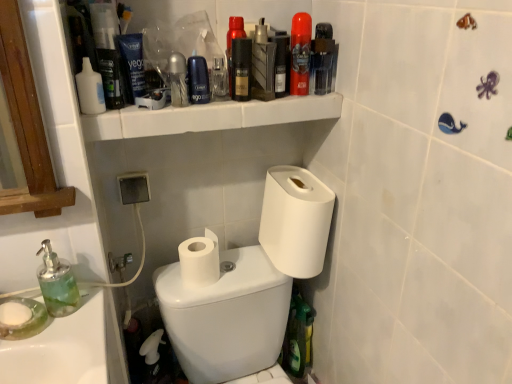
What do you see at coordinates (241, 69) in the screenshot?
I see `matte black bottle at center, acting as the fifth mouthwash starting from the left` at bounding box center [241, 69].

Measure the distance between point (x=215, y=245) and camera.

Point (x=215, y=245) is 1.09 meters away from camera.

The image size is (512, 384). Find the location of `shiny black bottle at upper center, placed as the 4th mouthwash when sorted from left to right`. shiny black bottle at upper center, placed as the 4th mouthwash when sorted from left to right is located at coordinates (232, 44).

Is transparent plastic mouthwash at upper right, the 9th mouthwash when ordered from left to right, turned away from green glass soap dispenser at lower left?

No, transparent plastic mouthwash at upper right, the 9th mouthwash when ordered from left to right, is not facing the opposite direction of green glass soap dispenser at lower left.

Visually, is transparent plastic mouthwash at upper right, the 9th mouthwash when ordered from left to right, positioned to the left or to the right of green glass soap dispenser at lower left?

In the image, transparent plastic mouthwash at upper right, the 9th mouthwash when ordered from left to right, appears on the right side of green glass soap dispenser at lower left.

From a real-world perspective, does transparent plastic mouthwash at upper right, the 9th mouthwash when ordered from left to right, sit lower than green glass soap dispenser at lower left?

No, from a real-world perspective, transparent plastic mouthwash at upper right, the 9th mouthwash when ordered from left to right, is not beneath green glass soap dispenser at lower left.

Which of these two, transparent plastic mouthwash at upper right, the 9th mouthwash when ordered from left to right, or green glass soap dispenser at lower left, is bigger?

Bigger between the two is green glass soap dispenser at lower left.

Considering the positions of objects transparent plastic mouthwash at upper right, positioned as the 1th mouthwash in right-to-left order, and white plastic bidet at lower right in the image provided, who is more to the left, transparent plastic mouthwash at upper right, positioned as the 1th mouthwash in right-to-left order, or white plastic bidet at lower right?

white plastic bidet at lower right is more to the left.

Considering the relative sizes of transparent plastic mouthwash at upper right, the 9th mouthwash when ordered from left to right, and white plastic bidet at lower right in the image provided, is transparent plastic mouthwash at upper right, the 9th mouthwash when ordered from left to right, shorter than white plastic bidet at lower right?

Yes.

Which of these two, transparent plastic mouthwash at upper right, positioned as the 1th mouthwash in right-to-left order, or white plastic bidet at lower right, is wider?

white plastic bidet at lower right is wider.

Considering the points (327, 91) and (183, 325), which point is in front, point (327, 91) or point (183, 325)?

The point (327, 91) is more forward.

The height and width of the screenshot is (384, 512). I want to click on the 2nd toilet paper directly beneath the blue matte tube at upper center, the second mouthwash in the left-to-right sequence (from a real-world perspective), so click(x=199, y=260).

Is blue matte tube at upper center, which is the 8th mouthwash in right-to-left order, oriented towards white matte toilet paper at center, placed as the second toilet paper when sorted from right to left?

No, blue matte tube at upper center, which is the 8th mouthwash in right-to-left order, is not facing towards white matte toilet paper at center, placed as the second toilet paper when sorted from right to left.

Based on the photo, are blue matte tube at upper center, which is the 8th mouthwash in right-to-left order, and white matte toilet paper at center, placed as the second toilet paper when sorted from right to left, located far from each other?

No, blue matte tube at upper center, which is the 8th mouthwash in right-to-left order, is not far from white matte toilet paper at center, placed as the second toilet paper when sorted from right to left.

Between blue matte tube at upper center, the second mouthwash in the left-to-right sequence, and white matte toilet paper at center, placed as the second toilet paper when sorted from right to left, which one has less height?

Standing shorter between the two is white matte toilet paper at center, placed as the second toilet paper when sorted from right to left.

Is matte blue shaving cream canister at upper center closer to camera compared to white plastic bidet at lower right?

That is False.

Is matte blue shaving cream canister at upper center surrounding white plastic bidet at lower right?

No, white plastic bidet at lower right is not surrounded by matte blue shaving cream canister at upper center.

Is point (201, 63) behind point (177, 324)?

No.

From the picture: Based on their positions, is matte blue shaving cream canister at upper center located to the left or right of white plastic bidet at lower right?

matte blue shaving cream canister at upper center is to the left of white plastic bidet at lower right.

Considering the sizes of green glass soap dispenser at lower left and metallic silver mouthwash at upper center, which appears as the third mouthwash when viewed from the left, in the image, is green glass soap dispenser at lower left wider or thinner than metallic silver mouthwash at upper center, which appears as the third mouthwash when viewed from the left,?

Considering their sizes, green glass soap dispenser at lower left looks broader than metallic silver mouthwash at upper center, which appears as the third mouthwash when viewed from the left.

Would you say green glass soap dispenser at lower left is inside or outside metallic silver mouthwash at upper center, the 7th mouthwash viewed from the right?

green glass soap dispenser at lower left is not enclosed by metallic silver mouthwash at upper center, the 7th mouthwash viewed from the right.

Can you confirm if green glass soap dispenser at lower left is shorter than metallic silver mouthwash at upper center, which appears as the third mouthwash when viewed from the left?

In fact, green glass soap dispenser at lower left may be taller than metallic silver mouthwash at upper center, which appears as the third mouthwash when viewed from the left.

Is green glass soap dispenser at lower left facing towards metallic silver mouthwash at upper center, which appears as the third mouthwash when viewed from the left?

No, green glass soap dispenser at lower left is not turned towards metallic silver mouthwash at upper center, which appears as the third mouthwash when viewed from the left.

Find the location of a particular element. This screenshot has height=384, width=512. mouthwash that is the 1st object located above the translucent green soap dispenser at lower left (from the image's perspective) is located at coordinates (90, 89).

Can you tell me how much white plastic bottle at upper left, arranged as the first mouthwash when viewed from the left, and translucent green soap dispenser at lower left differ in facing direction?

There is a 1.09-degree angle between the facing directions of white plastic bottle at upper left, arranged as the first mouthwash when viewed from the left, and translucent green soap dispenser at lower left.

Is white plastic bottle at upper left, arranged as the first mouthwash when viewed from the left, oriented away from translucent green soap dispenser at lower left?

No, translucent green soap dispenser at lower left is not at the back of white plastic bottle at upper left, arranged as the first mouthwash when viewed from the left.

Is point (104, 98) farther from viewer compared to point (58, 313)?

No.

Is matte black bottle at center, acting as the fifth mouthwash starting from the left, next to shiny black bottle at upper center, placed as the 4th mouthwash when sorted from left to right, and touching it?

Yes, matte black bottle at center, acting as the fifth mouthwash starting from the left, is with shiny black bottle at upper center, placed as the 4th mouthwash when sorted from left to right.

Starting from the shiny black bottle at upper center, placed as the 4th mouthwash when sorted from left to right, which mouthwash is the 3rd one in front? Please provide its 2D coordinates.

[(241, 69)]

Does matte black bottle at center, positioned as the fifth mouthwash in right-to-left order, have a greater height compared to shiny black bottle at upper center, the 6th mouthwash positioned from the right?

In fact, matte black bottle at center, positioned as the fifth mouthwash in right-to-left order, may be shorter than shiny black bottle at upper center, the 6th mouthwash positioned from the right.

From the image's perspective, which one is positioned lower, matte black bottle at center, acting as the fifth mouthwash starting from the left, or shiny black bottle at upper center, the 6th mouthwash positioned from the right?

matte black bottle at center, acting as the fifth mouthwash starting from the left, is shown below in the image.

From a real-world perspective, which mouthwash is the 6th one above the green glass soap dispenser at lower left? Please provide its 2D coordinates.

[(323, 58)]

Identify the location of the 5th mouthwash counting from the right of the white plastic bidet at lower right. The height and width of the screenshot is (384, 512). (323, 58).

Estimate the real-world distances between objects in this image. Which object is closer to white plastic bidet at lower right, transparent plastic mouthwash at upper right, the 9th mouthwash when ordered from left to right, or red matte mouthwash at upper center, arranged as the 2th mouthwash when viewed from the right?

red matte mouthwash at upper center, arranged as the 2th mouthwash when viewed from the right, lies closer to white plastic bidet at lower right than the other object.

Based on their spatial positions, is white plastic shelf at upper center or metallic silver mouthwash at upper center, the 7th mouthwash viewed from the right, further from metallic silver mouthwash at upper center, which is the 6th mouthwash in left-to-right order?

Based on the image, metallic silver mouthwash at upper center, the 7th mouthwash viewed from the right, appears to be further to metallic silver mouthwash at upper center, which is the 6th mouthwash in left-to-right order.

Considering their positions, is white matte toilet paper at center, acting as the first toilet paper starting from the left, positioned further to transparent plastic mouthwash at upper right, positioned as the 1th mouthwash in right-to-left order, than metallic silver mouthwash at upper center, which is the 6th mouthwash in left-to-right order?

white matte toilet paper at center, acting as the first toilet paper starting from the left, lies further to transparent plastic mouthwash at upper right, positioned as the 1th mouthwash in right-to-left order, than the other object.

Looking at the image, which one is located further to white plastic bottle at upper left, arranged as the first mouthwash when viewed from the left, translucent green soap dispenser at lower left or white plastic shelf at upper center?

translucent green soap dispenser at lower left is further to white plastic bottle at upper left, arranged as the first mouthwash when viewed from the left.

From the image, which object appears to be nearer to red matte mouthwash at upper center, the 8th mouthwash positioned from the left, white plastic shelf at upper center or blue matte tube at upper center, the second mouthwash in the left-to-right sequence?

white plastic shelf at upper center.

Estimate the real-world distances between objects in this image. Which object is further from black matte bottle at upper center, positioned as the 7th mouthwash in left-to-right order, white plastic bidet at lower right or white plastic shelf at upper center?

white plastic bidet at lower right is positioned further to the anchor black matte bottle at upper center, positioned as the 7th mouthwash in left-to-right order.

Considering their positions, is red matte mouthwash at upper center, the 8th mouthwash positioned from the left, positioned further to metallic silver mouthwash at upper center, which is the 6th mouthwash in left-to-right order, than translucent green soap dispenser at lower left?

translucent green soap dispenser at lower left is further to metallic silver mouthwash at upper center, which is the 6th mouthwash in left-to-right order.

Based on their spatial positions, is red matte mouthwash at upper center, arranged as the 2th mouthwash when viewed from the right, or green glass soap dispenser at lower left closer to black matte bottle at upper center, which appears as the 3th mouthwash when viewed from the right?

red matte mouthwash at upper center, arranged as the 2th mouthwash when viewed from the right, is positioned closer to the anchor black matte bottle at upper center, which appears as the 3th mouthwash when viewed from the right.

Find the location of `mouthwash between matte black bottle at center, acting as the fifth mouthwash starting from the left, and black matte bottle at upper center, which appears as the 3th mouthwash when viewed from the right, from left to right`. mouthwash between matte black bottle at center, acting as the fifth mouthwash starting from the left, and black matte bottle at upper center, which appears as the 3th mouthwash when viewed from the right, from left to right is located at coordinates (x=263, y=64).

The height and width of the screenshot is (384, 512). What are the coordinates of `toilet paper between metallic silver mouthwash at upper center, which is the 6th mouthwash in left-to-right order, and white matte toilet paper at center, placed as the second toilet paper when sorted from right to left, in the up-down direction` in the screenshot? It's located at (295, 220).

I want to click on product between blue matte tube at upper center, the second mouthwash in the left-to-right sequence, and green glass soap dispenser at lower left in the up-down direction, so click(198, 80).

What are the coordinates of `mouthwash between metallic silver mouthwash at upper center, the 7th mouthwash viewed from the right, and white plastic bidet at lower right from top to bottom` in the screenshot? It's located at (90, 89).